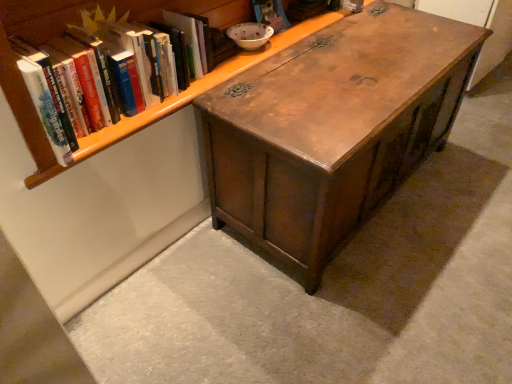
Question: Does point (27, 99) appear closer or farther from the camera than point (170, 81)?

Choices:
 (A) farther
 (B) closer

Answer: (B)

Question: Would you say wooden bookshelf at upper left is to the left or to the right of hardcover book at upper left in the picture?

Choices:
 (A) right
 (B) left

Answer: (A)

Question: Which object is the closest to the hardcover book at upper left?

Choices:
 (A) wooden bookshelf at upper left
 (B) wooden chest at center

Answer: (A)

Question: Which of these objects is positioned closest to the wooden chest at center?

Choices:
 (A) wooden bookshelf at upper left
 (B) hardcover book at upper left

Answer: (A)